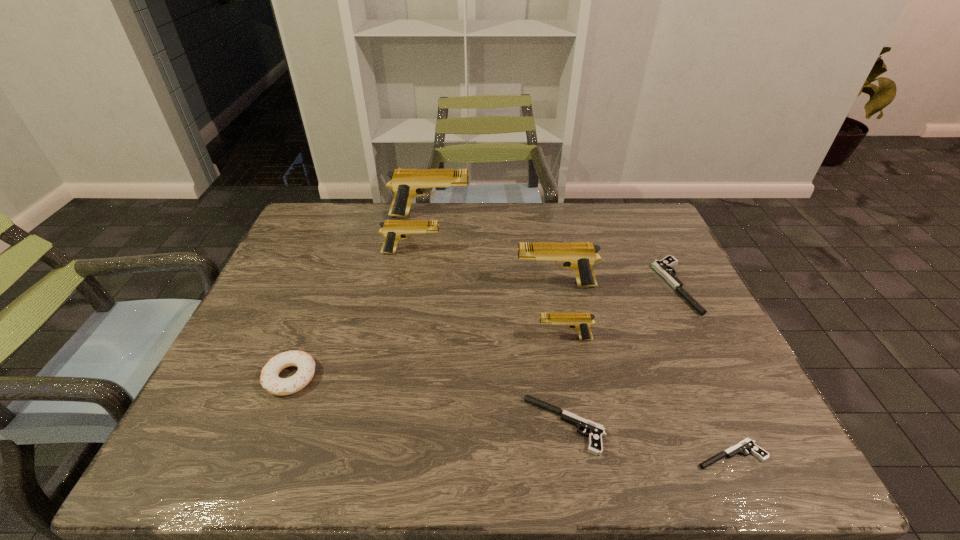
Locate an element on the screen. The width and height of the screenshot is (960, 540). vacant space located on the front-facing side of the leftmost black pistol is located at coordinates (457, 425).

This screenshot has width=960, height=540. I want to click on free region located on the front-facing side of the shortest object, so click(622, 455).

Identify the location of vacant region located 0.340m on the front-facing side of the shortest object. This screenshot has width=960, height=540. (518, 455).

At what (x,y) coordinates should I click in order to perform the action: click on free space located on the front-facing side of the shortest object. Please return your answer as a coordinate pair (x, y). The height and width of the screenshot is (540, 960). Looking at the image, I should click on (659, 455).

This screenshot has width=960, height=540. I want to click on object that is at the far edge, so click(406, 183).

Locate an element on the screen. object situated at the left edge is located at coordinates (269, 379).

Where is `object located at the near right corner`? object located at the near right corner is located at coordinates (747, 444).

Locate an element on the screen. The width and height of the screenshot is (960, 540). vacant region at the far edge of the desktop is located at coordinates (536, 231).

I want to click on vacant area at the near edge, so click(357, 469).

Locate an element on the screen. free space at the left edge of the desktop is located at coordinates (318, 274).